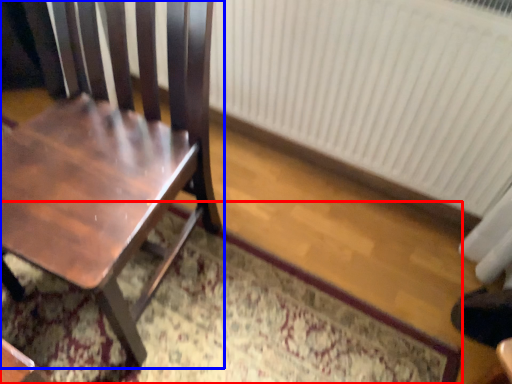
Question: Which point is further to the camera, doormat (highlighted by a red box) or chair (highlighted by a blue box)?

Choices:
 (A) doormat
 (B) chair

Answer: (A)